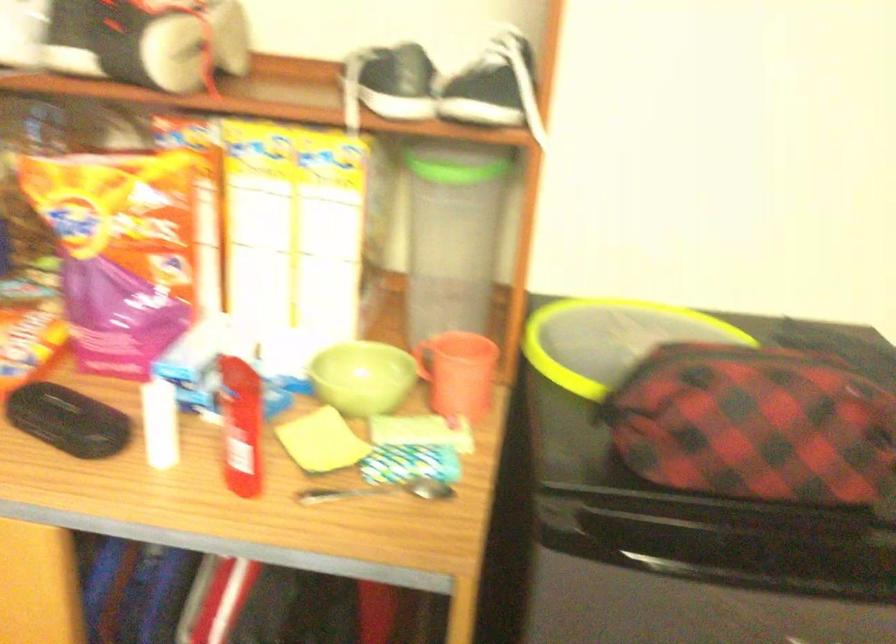
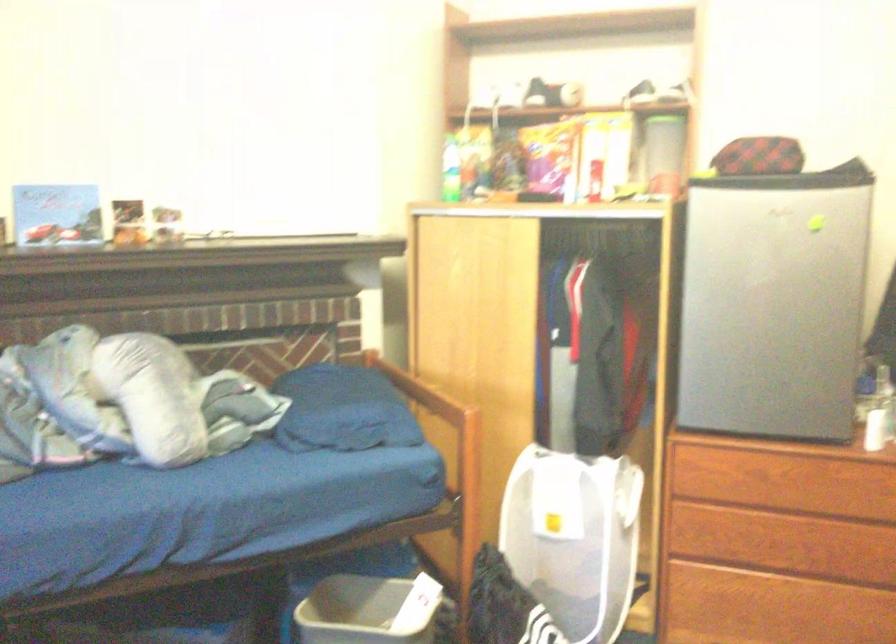
Question: What movement of the cameraman would produce the second image?

Choices:
 (A) Left
 (B) Right
 (C) Forward
 (D) Backward

Answer: (D)